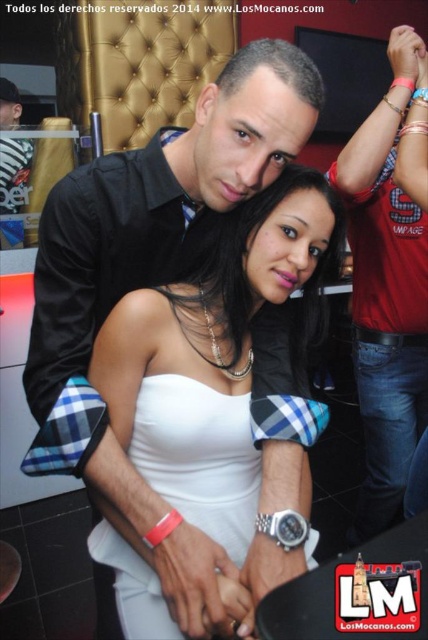
Question: Can you confirm if red plaid shirt at center is thinner than white matte dress at center?

Choices:
 (A) no
 (B) yes

Answer: (B)

Question: Which object appears farthest from the camera in this image?

Choices:
 (A) red plaid shirt at center
 (B) white satin dress at center
 (C) white matte dress at center

Answer: (A)

Question: Which point is closer to the camera?

Choices:
 (A) (124, 570)
 (B) (276, 218)
 (C) (371, 412)

Answer: (B)

Question: Does red plaid shirt at center lie in front of white matte dress at center?

Choices:
 (A) yes
 (B) no

Answer: (B)

Question: Which object is positioned closest to the red plaid shirt at center?

Choices:
 (A) white matte dress at center
 (B) white satin dress at center

Answer: (B)

Question: Does white satin dress at center have a lesser width compared to red plaid shirt at center?

Choices:
 (A) no
 (B) yes

Answer: (A)